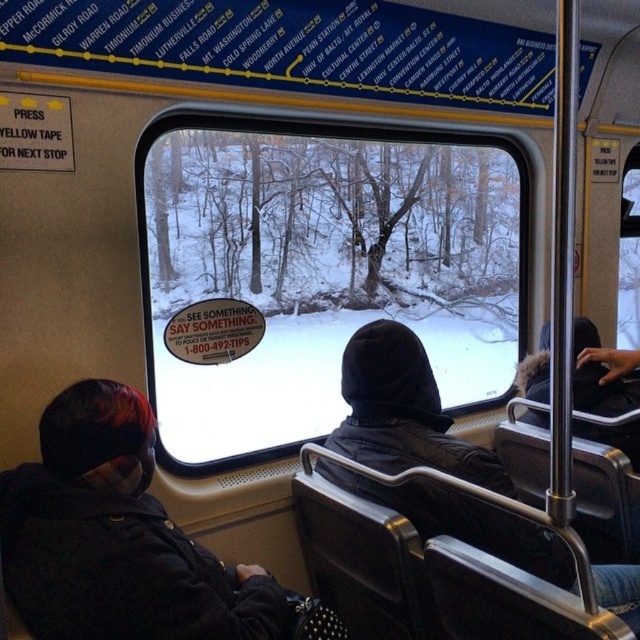
Can you confirm if transparent glass window at center is positioned below dark gray jacket at lower left?

No.

Does transparent glass window at center have a smaller size compared to dark gray jacket at lower left?

No.

Where is `transparent glass window at center`? Image resolution: width=640 pixels, height=640 pixels. transparent glass window at center is located at coordinates (323, 268).

You are a GUI agent. You are given a task and a screenshot of the screen. Output one action in this format:
    pyautogui.click(x=<x>, y=<y>)
    Task: Click on the transparent glass window at center
    
    Given the screenshot: What is the action you would take?
    pyautogui.click(x=323, y=268)

Does transparent glass window at center have a larger size compared to black leather jacket at center?

Indeed, transparent glass window at center has a larger size compared to black leather jacket at center.

Is point (372, 161) closer to viewer compared to point (362, 456)?

No, (372, 161) is behind (362, 456).

At what (x,y) coordinates should I click in order to perform the action: click on transparent glass window at center. Please return your answer as a coordinate pair (x, y). Looking at the image, I should click on (323, 268).

Between dark gray jacket at lower left and black leather jacket at center, which one appears on the left side from the viewer's perspective?

dark gray jacket at lower left is more to the left.

Which of these two, dark gray jacket at lower left or black leather jacket at center, stands shorter?

Standing shorter between the two is dark gray jacket at lower left.

Who is more distant from viewer, (209, 580) or (404, 410)?

Point (404, 410)

The height and width of the screenshot is (640, 640). Identify the location of dark gray jacket at lower left. (124, 540).